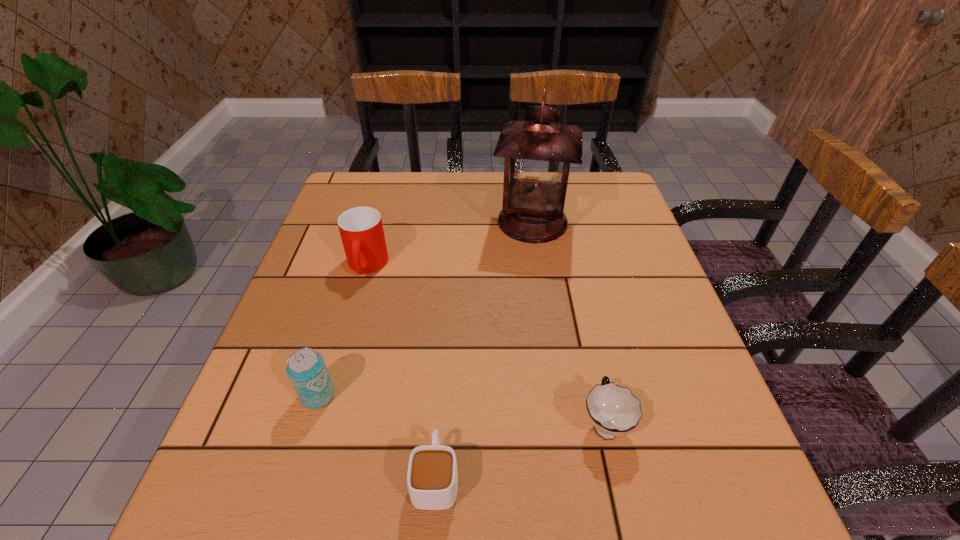
Where is `free space at the left edge`? free space at the left edge is located at coordinates (323, 317).

Image resolution: width=960 pixels, height=540 pixels. Identify the location of vacant space at the right edge of the desktop. (636, 237).

Where is `free space at the far left corner of the desktop`? free space at the far left corner of the desktop is located at coordinates (367, 192).

Image resolution: width=960 pixels, height=540 pixels. In order to click on free space at the near left corner in this screenshot , I will do `click(198, 538)`.

Find the location of a particular element. vacant space at the far right corner of the desktop is located at coordinates (587, 180).

Identify the location of free location at the near right corner of the desktop. This screenshot has width=960, height=540. (661, 500).

Where is `free spot between the second cup from right to left and the rightmost cup`? free spot between the second cup from right to left and the rightmost cup is located at coordinates (520, 449).

You are a GUI agent. You are given a task and a screenshot of the screen. Output one action in this format:
    pyautogui.click(x=<x>, y=<y>)
    Task: Click on the free spot between the rightmost cup and the oil lamp
    
    Given the screenshot: What is the action you would take?
    pyautogui.click(x=568, y=322)

Find the location of a particular element. The width and height of the screenshot is (960, 540). free area in between the third shortest object and the tallest object is located at coordinates (425, 309).

The height and width of the screenshot is (540, 960). I want to click on vacant space in between the oil lamp and the third tallest object, so click(425, 309).